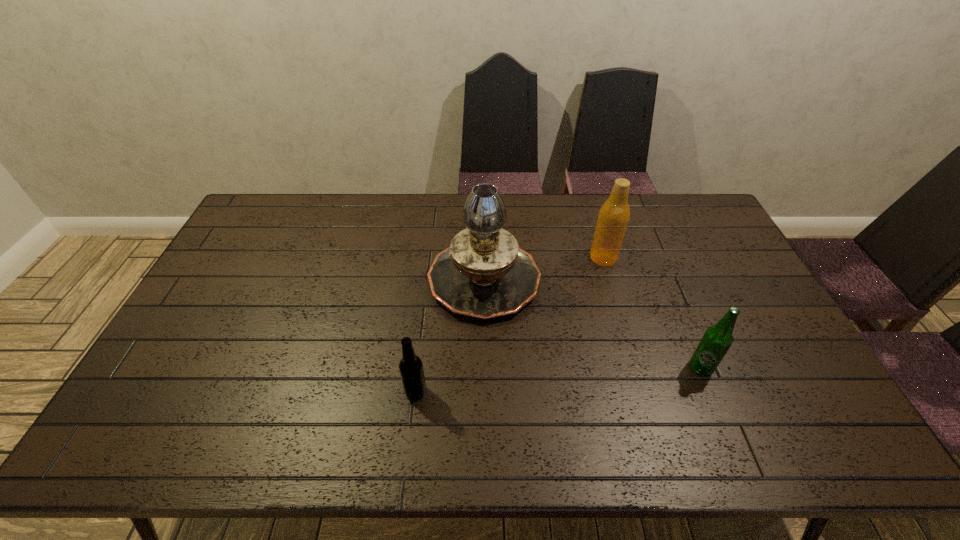
Locate an element on the screen. This screenshot has width=960, height=540. free space between the leftmost beer bottle and the tallest beer bottle is located at coordinates (510, 325).

Find the location of a particular element. vacant area that lies between the third object from left to right and the nearest object is located at coordinates (510, 325).

In order to click on free space between the third farthest object and the second object from right to left in this screenshot , I will do `click(652, 313)`.

Locate an element on the screen. vacant area between the tallest beer bottle and the oil lamp is located at coordinates (543, 267).

Identify the location of vacant area that lies between the oil lamp and the nearest beer bottle. The height and width of the screenshot is (540, 960). (450, 335).

This screenshot has height=540, width=960. Find the location of `vacant point located between the leftmost beer bottle and the second farthest beer bottle`. vacant point located between the leftmost beer bottle and the second farthest beer bottle is located at coordinates (558, 380).

I want to click on unoccupied area between the oil lamp and the second nearest beer bottle, so coord(592,323).

Where is `object that is the third closest one to the farthest beer bottle`? object that is the third closest one to the farthest beer bottle is located at coordinates (411, 369).

Identify which object is the second nearest to the rightmost beer bottle. Please provide its 2D coordinates. Your answer should be formatted as a tuple, i.e. [(x, y)], where the tuple contains the x and y coordinates of a point satisfying the conditions above.

[(484, 274)]

Identify which beer bottle is the third nearest to the oil lamp. Please provide its 2D coordinates. Your answer should be formatted as a tuple, i.e. [(x, y)], where the tuple contains the x and y coordinates of a point satisfying the conditions above.

[(716, 341)]